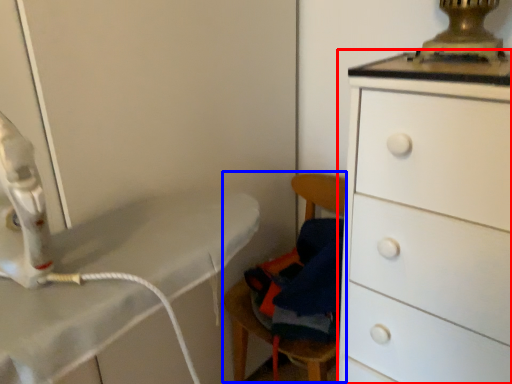
Question: Among these objects, which one is nearest to the camera, chest of drawers (highlighted by a red box) or swivel chair (highlighted by a blue box)?

Choices:
 (A) chest of drawers
 (B) swivel chair

Answer: (A)